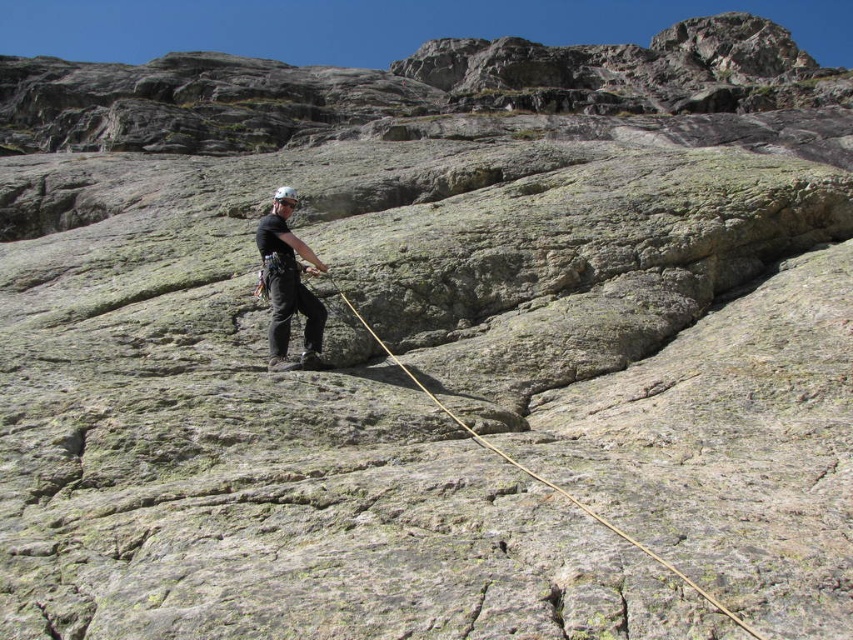
You are a safety inspector evaluating the rock climber. According to safety guidelines, the helmet must be within 10 feet of the rope to ensure quick access in case of an emergency. Is the current distance between the matte black helmet at center and the brown rough rope at center compliant with safety standards?

The distance between the matte black helmet at center and the brown rough rope at center is 13.37 feet, which exceeds the 10 feet safety guideline. Therefore, the current setup does not comply with safety standards.

You are a drone operator trying to capture the climber safely. The climber is at point (x=287, y=284). You need to avoid the matte black helmet at center. Where should you position your drone relative to the climber?

The matte black helmet at center is located at point (x=287, y=284). To avoid it, position the drone above or beside the climber, ensuring it stays clear of the helmet.